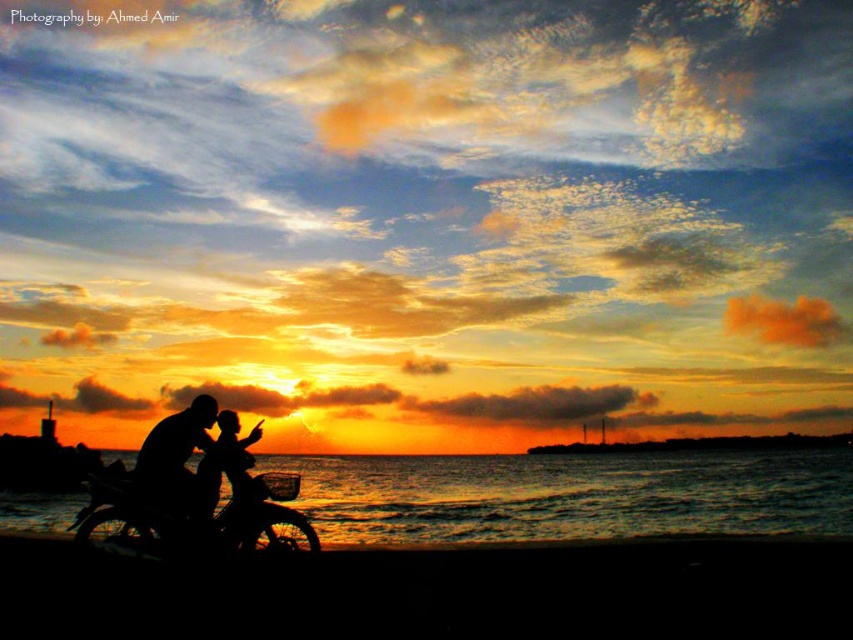
Based on the photo, you are standing at the beach watching the sunset and see two points in the scene. The first point is at coordinates point (351, 614) and the second is at point (264, 500). Which point is closer to your eyes?

Point (351, 614) is closer to the camera than point (264, 500), so the first point is closer to your eyes.

You are standing on the beach watching the sunset. You see the black water at lower center and the silhouette human at center. Which object is closer to the horizon?

The black water at lower center is closer to the horizon because it is located below the silhouette human at center, placing it lower in the scene.

You are standing at the beach watching the sunset. You see the black sand at lower center and the black matte motorcycle at lower left. Which object is nearer to you?

The black sand at lower center is closer to the viewer than the black matte motorcycle at lower left.